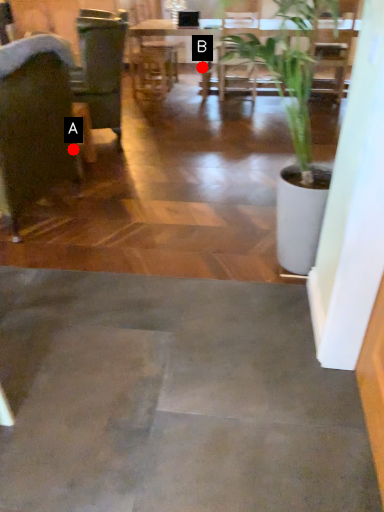
Question: Two points are circled on the image, labeled by A and B beside each circle. Which point is further to the camera?

Choices:
 (A) A is further
 (B) B is further

Answer: (B)